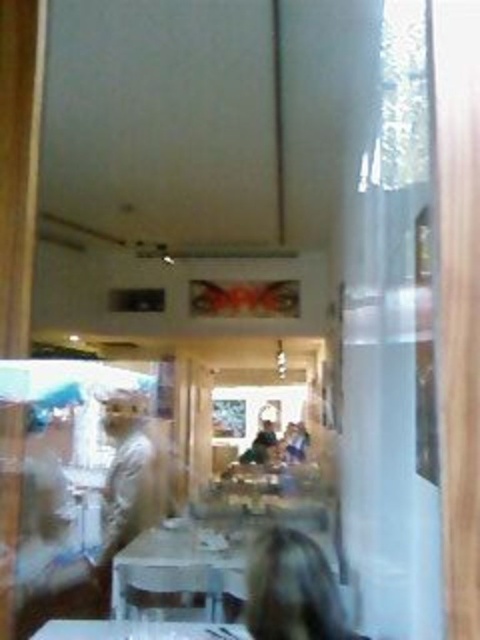
Identify the location of white glossy table at center. Image resolution: width=480 pixels, height=640 pixels. (181, 570).

Which is behind, point (132, 612) or point (61, 632)?

Point (132, 612)

This screenshot has height=640, width=480. I want to click on white glossy table at center, so click(x=181, y=570).